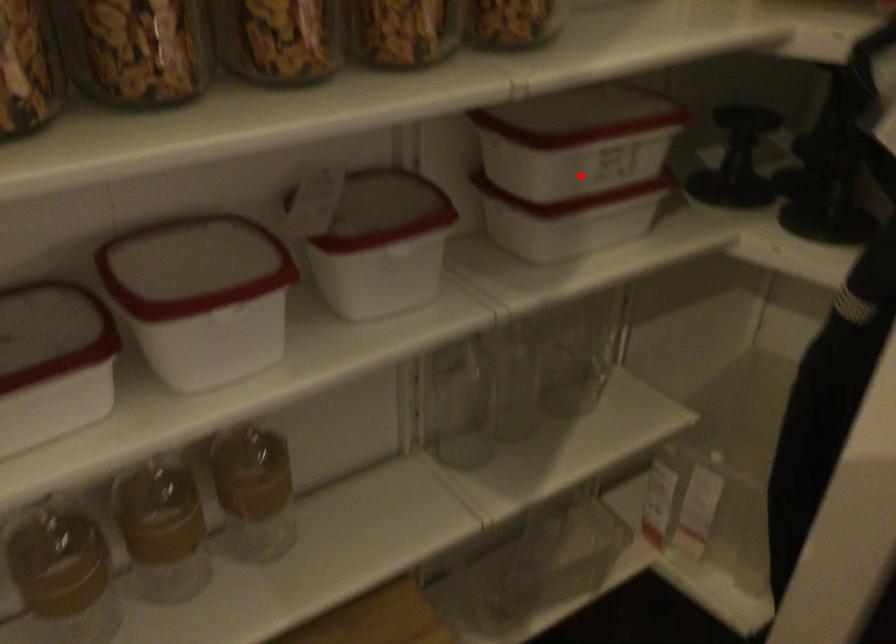
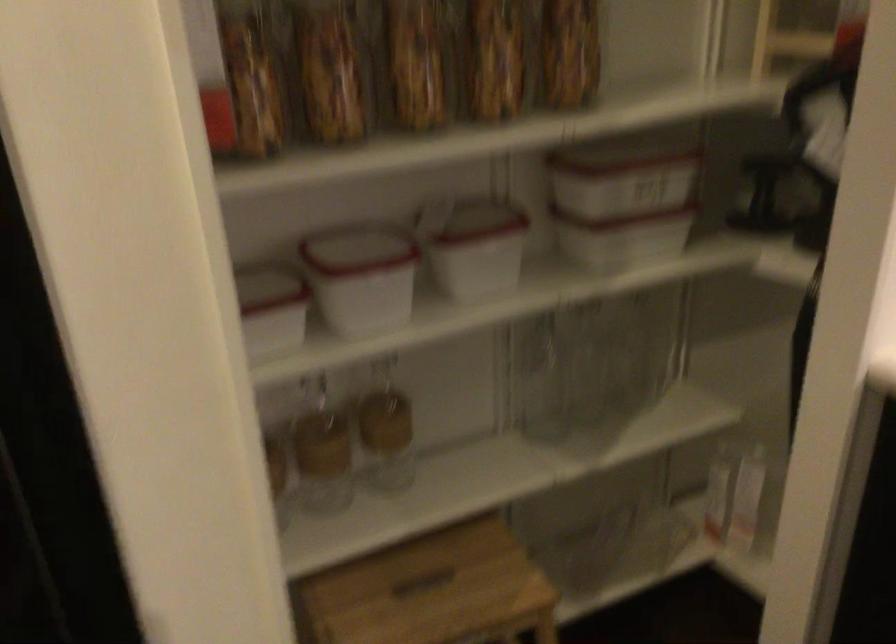
Locate, in the second image, the point that corresponds to the highlighted location in the first image.

(622, 204)